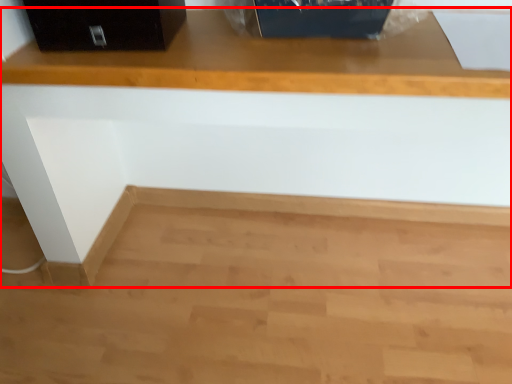
Question: In this image, where is furniture (annotated by the red box) located relative to file cabinet?

Choices:
 (A) right
 (B) left

Answer: (A)